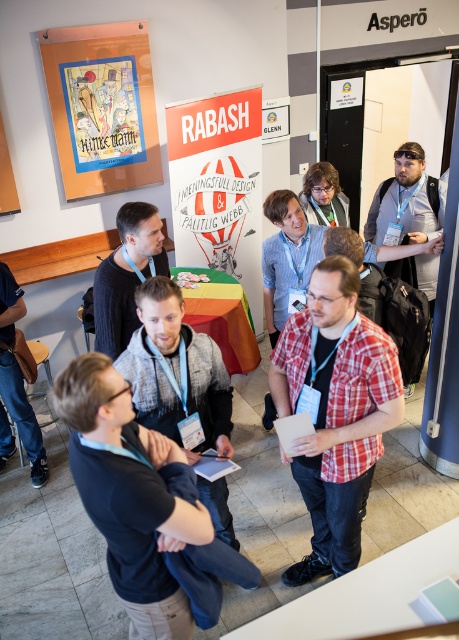
Who is positioned more to the left, matte paper poster at upper left or black matte shirt at center?

Positioned to the left is matte paper poster at upper left.

Between matte paper poster at upper left and black matte shirt at center, which one appears on the right side from the viewer's perspective?

black matte shirt at center is more to the right.

The height and width of the screenshot is (640, 459). I want to click on matte paper poster at upper left, so click(101, 106).

Can you confirm if dark blue sweater at center is shorter than matte black shirt at center?

No.

Between dark blue sweater at center and matte black shirt at center, which one appears on the right side from the viewer's perspective?

Positioned to the right is dark blue sweater at center.

Who is more distant from viewer, (253, 570) or (157, 273)?

The point (157, 273) is more distant.

Identify the location of dark blue sweater at center. (144, 508).

Is point (408, 184) in front of point (1, 396)?

No, (408, 184) is behind (1, 396).

Locate an element on the screen. The width and height of the screenshot is (459, 640). gray fabric shirt at right is located at coordinates [x=407, y=202].